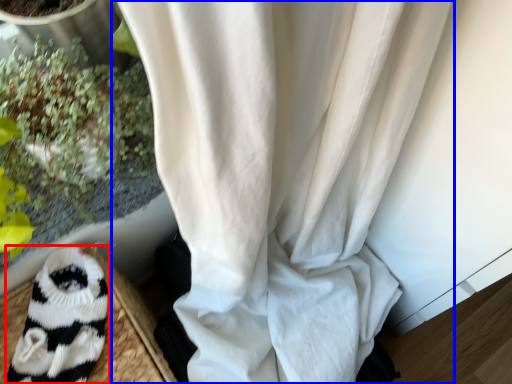
Question: Which of the following is the closest to the observer, animal (highlighted by a red box) or curtain (highlighted by a blue box)?

Choices:
 (A) animal
 (B) curtain

Answer: (A)